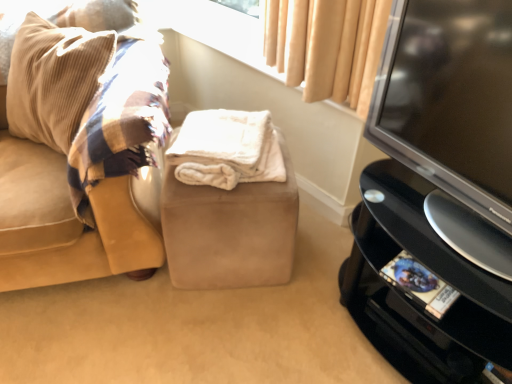
Question: Is point (208, 120) closer or farther from the camera than point (226, 238)?

Choices:
 (A) closer
 (B) farther

Answer: (B)

Question: Based on their sizes in the image, would you say white fluffy blanket at center is bigger or smaller than suede beige stool at center?

Choices:
 (A) small
 (B) big

Answer: (A)

Question: Which object is the closest to the black glossy television at right?

Choices:
 (A) white fluffy blanket at center
 (B) suede beige stool at center
 (C) black plastic tv stand at right
 (D) beige fabric at upper center
 (E) suede couch at left

Answer: (C)

Question: Which object is positioned farthest from the beige fabric at upper center?

Choices:
 (A) black glossy television at right
 (B) suede beige stool at center
 (C) suede couch at left
 (D) white fluffy blanket at center
 (E) black plastic tv stand at right

Answer: (C)